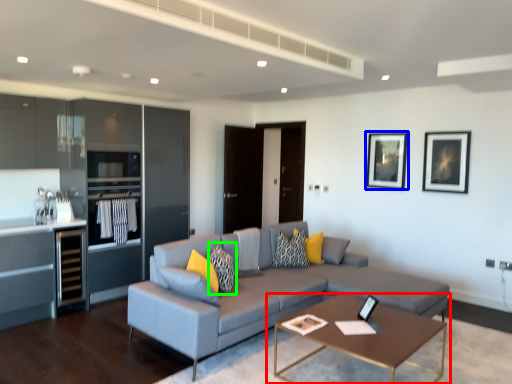
Question: Which object is positioned closest to coffee table (highlighted by a red box)? Select from picture frame (highlighted by a blue box) and pillow (highlighted by a green box).

Choices:
 (A) picture frame
 (B) pillow

Answer: (B)